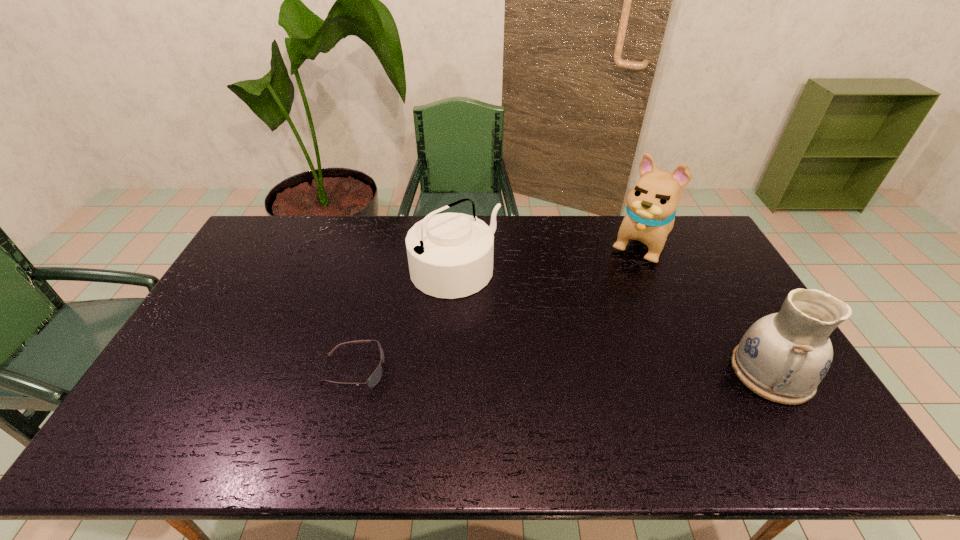
Where is `free space located 0.050m on the face of the tallest object`? The image size is (960, 540). free space located 0.050m on the face of the tallest object is located at coordinates (625, 271).

Find the location of `vacant region located 0.090m on the face of the tallest object`. vacant region located 0.090m on the face of the tallest object is located at coordinates (621, 277).

Locate an element on the screen. This screenshot has width=960, height=540. free space located on the face of the tallest object is located at coordinates (604, 301).

In order to click on kettle located at the far edge in this screenshot , I will do `click(450, 255)`.

At what (x,y) coordinates should I click in order to perform the action: click on puppy present at the far edge. Please return your answer as a coordinate pair (x, y). The height and width of the screenshot is (540, 960). Looking at the image, I should click on (651, 205).

Locate an element on the screen. This screenshot has height=540, width=960. sunglasses present at the near edge is located at coordinates (373, 380).

At what (x,y) coordinates should I click in order to perform the action: click on pottery positioned at the near edge. Please return your answer as a coordinate pair (x, y). This screenshot has width=960, height=540. Looking at the image, I should click on (782, 357).

Where is `pottery that is at the right edge`? Image resolution: width=960 pixels, height=540 pixels. pottery that is at the right edge is located at coordinates (782, 357).

What are the coordinates of `puppy positioned at the right edge` in the screenshot? It's located at (651, 205).

Image resolution: width=960 pixels, height=540 pixels. I want to click on object located at the far right corner, so click(651, 205).